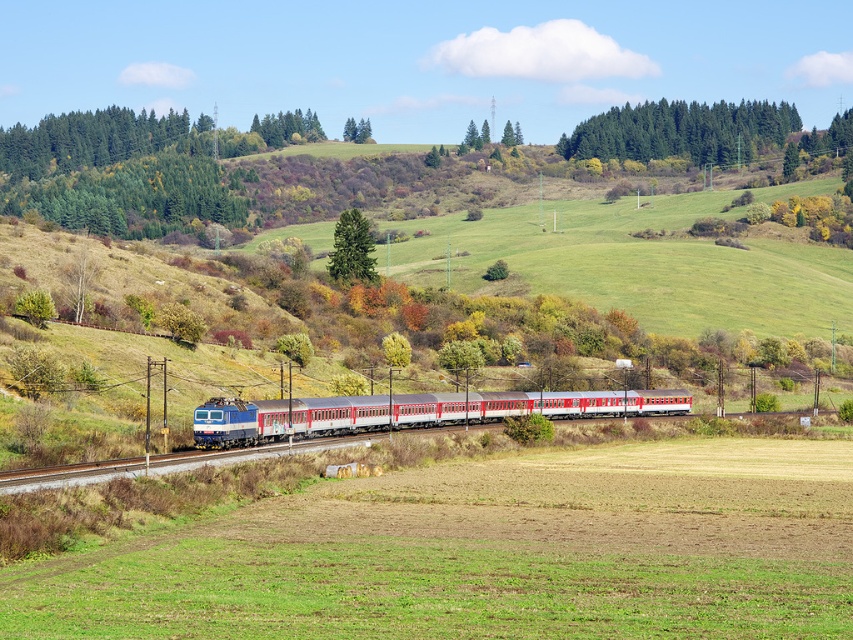
Question: Which point appears farthest from the camera in this image?

Choices:
 (A) (122, 616)
 (B) (354, 243)

Answer: (B)

Question: Does green grassy field at center appear under green leafy forest at upper center?

Choices:
 (A) yes
 (B) no

Answer: (A)

Question: Which point is closer to the camera?

Choices:
 (A) (517, 596)
 (B) (622, 410)
 (C) (341, 241)

Answer: (A)

Question: Which object is positioned closest to the green grassy field at center?

Choices:
 (A) green textured tree at center
 (B) polished aluminum train at center

Answer: (B)

Question: Is polished aluminum train at center thinner than green leafy forest at upper center?

Choices:
 (A) no
 (B) yes

Answer: (B)

Question: Does green grassy field at center appear on the left side of polished aluminum train at center?

Choices:
 (A) no
 (B) yes

Answer: (A)